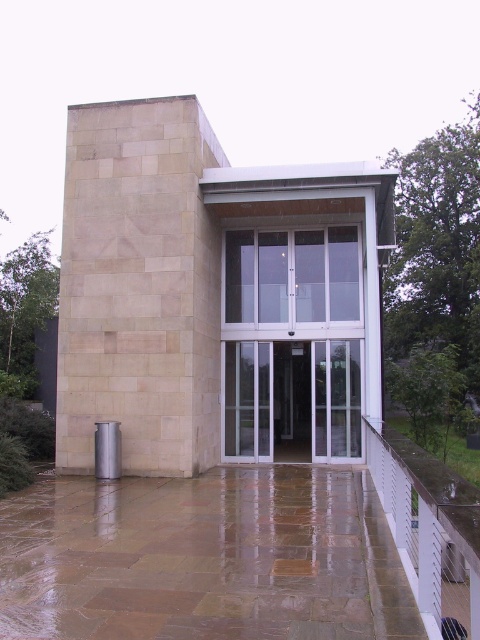
You are standing in front of the building entrance and want to enter. The entrance has a transparent glass door at center and a satin silver cylinder at lower left. Which object is positioned to the right of the other?

The transparent glass door at center is to the right of the satin silver cylinder at lower left.

You are a delivery person with a package that requires a 1.2 meter clearance to maneuver safely. You need to navigate between the beige stone pillar at left and the satin silver cylinder at lower left. Can you safely pass through the space between them?

The distance between the beige stone pillar at left and the satin silver cylinder at lower left is 1.05 meters, which is less than the required 1.2 meters clearance. Therefore, you cannot safely pass through the space between them.

You are a delivery person trying to enter the building through the transparent glass door at center. The satin silver cylinder at lower left is blocking your path. Can you walk around it to reach the door?

The transparent glass door at center is above the satin silver cylinder at lower left, meaning the cylinder is positioned lower and closer to the ground. Since it is at a lower position, you can walk around it to reach the transparent glass door at center.